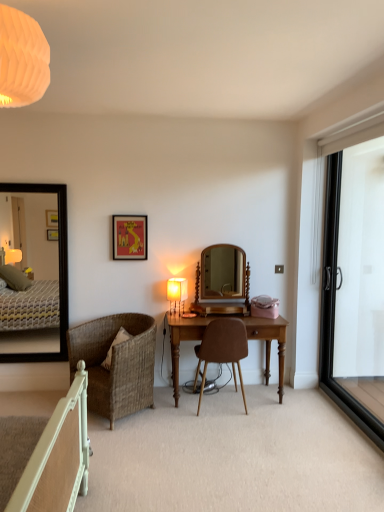
Where is `free space in front of wooden desk at center`? Image resolution: width=384 pixels, height=512 pixels. free space in front of wooden desk at center is located at coordinates (233, 436).